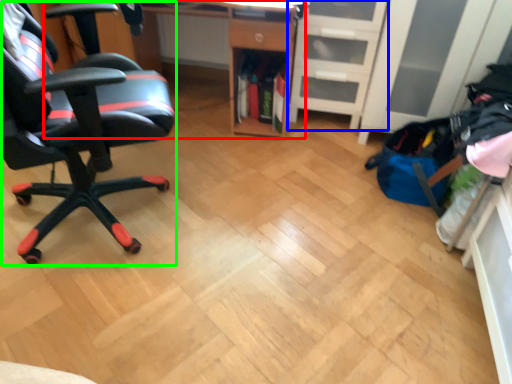
Question: Estimate the real-world distances between objects in this image. Which object is farther from desk (highlighted by a red box), file cabinet (highlighted by a blue box) or chair (highlighted by a green box)?

Choices:
 (A) file cabinet
 (B) chair

Answer: (B)